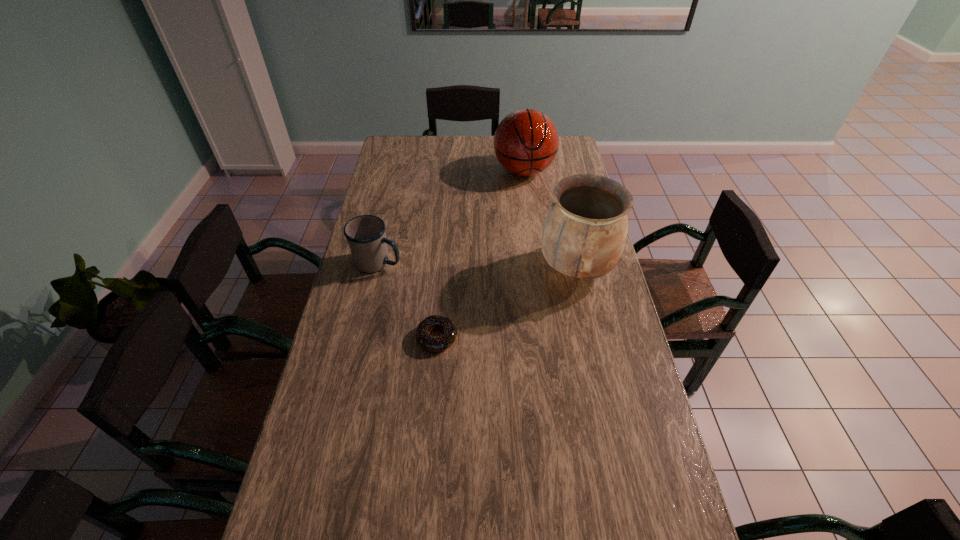
Identify the location of the nearest object. Image resolution: width=960 pixels, height=540 pixels. (435, 344).

The height and width of the screenshot is (540, 960). I want to click on the second object from left to right, so [435, 344].

You are a GUI agent. You are given a task and a screenshot of the screen. Output one action in this format:
    pyautogui.click(x=<x>, y=<y>)
    Task: Click on the urn
    Image resolution: width=960 pixels, height=540 pixels.
    Given the screenshot: What is the action you would take?
    pyautogui.click(x=585, y=230)

I want to click on the farthest object, so click(x=526, y=141).

Find the location of a particular element. mug is located at coordinates (366, 236).

The width and height of the screenshot is (960, 540). In order to click on the second shortest object in this screenshot , I will do `click(366, 236)`.

This screenshot has height=540, width=960. I want to click on free spot located on the front of the doughnut, so 424,491.

Where is `free space located on the back of the urn`? Image resolution: width=960 pixels, height=540 pixels. free space located on the back of the urn is located at coordinates (562, 203).

The image size is (960, 540). In order to click on vacant space located on the side with spill of the basketball in this screenshot , I will do `click(524, 219)`.

Where is `vacant space situated 0.060m on the side with spill of the basketball`? The height and width of the screenshot is (540, 960). vacant space situated 0.060m on the side with spill of the basketball is located at coordinates (524, 198).